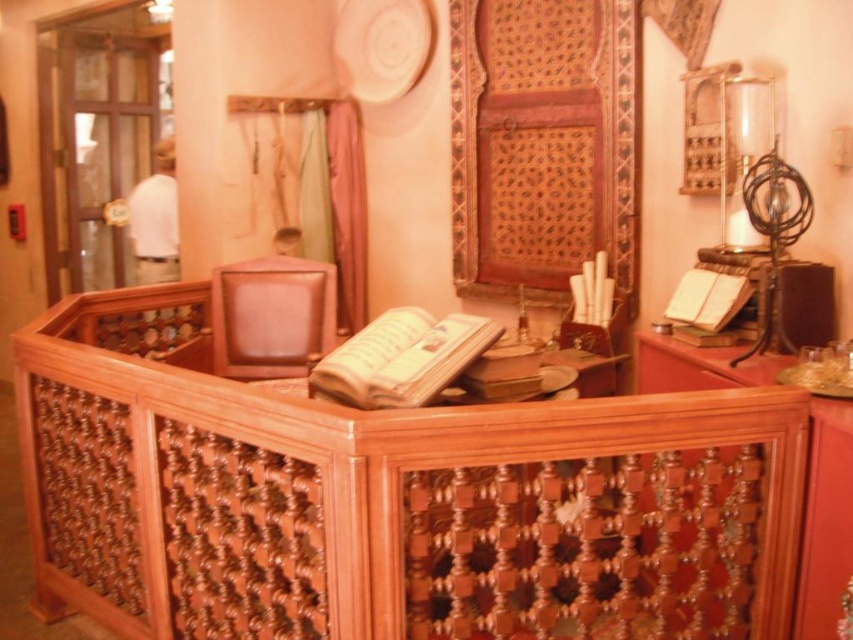
Which is above, clear glass globe at upper right or clear glass cylinder at right?

clear glass cylinder at right is above.

Between clear glass globe at upper right and clear glass cylinder at right, which one is positioned lower?

clear glass globe at upper right

This screenshot has height=640, width=853. Identify the location of clear glass globe at upper right. (766, 188).

Find the location of a particular element. The image size is (853, 640). clear glass globe at upper right is located at coordinates (766, 188).

Measure the distance between point (306, 314) and camera.

3.34 meters

Who is more distant from viewer, (229, 266) or (775, 202)?

Positioned behind is point (229, 266).

Is point (213, 358) behind point (743, 140)?

Yes, point (213, 358) is behind point (743, 140).

At what (x,y) coordinates should I click in order to perform the action: click on leather at center. Please return your answer as a coordinate pair (x, y). The height and width of the screenshot is (640, 853). Looking at the image, I should click on (271, 316).

Can you confirm if clear glass cylinder at right is smaller than matte brown book at right?

Actually, clear glass cylinder at right might be larger than matte brown book at right.

Between clear glass cylinder at right and matte brown book at right, which one appears on the right side from the viewer's perspective?

clear glass cylinder at right

The width and height of the screenshot is (853, 640). I want to click on clear glass cylinder at right, so click(x=741, y=150).